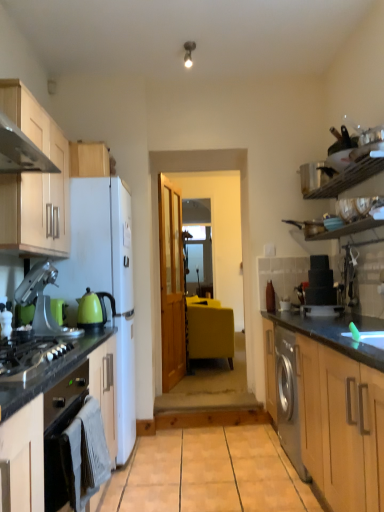
Question: Does black granite countertop at right have a lesser height compared to white glossy plate at right, which is counted as the second appliance, starting from the top?

Choices:
 (A) no
 (B) yes

Answer: (A)

Question: Is black granite countertop at right oriented towards white glossy plate at right, which is counted as the second appliance, starting from the top?

Choices:
 (A) yes
 (B) no

Answer: (B)

Question: Can you confirm if black granite countertop at right is thinner than white glossy plate at right, which is counted as the second appliance, starting from the top?

Choices:
 (A) yes
 (B) no

Answer: (B)

Question: From the image's perspective, does black granite countertop at right appear lower than white glossy plate at right, the first appliance in the bottom-to-top sequence?

Choices:
 (A) yes
 (B) no

Answer: (A)

Question: Considering the relative sizes of black granite countertop at right and white glossy plate at right, which is counted as the second appliance, starting from the top, in the image provided, is black granite countertop at right wider than white glossy plate at right, which is counted as the second appliance, starting from the top,?

Choices:
 (A) yes
 (B) no

Answer: (A)

Question: From a real-world perspective, is white matte refrigerator at left physically located above or below metallic silver pot at upper right, which ranks as the 2th appliance in bottom-to-top order?

Choices:
 (A) below
 (B) above

Answer: (A)

Question: In the image, is white matte refrigerator at left positioned in front of or behind metallic silver pot at upper right, which ranks as the 2th appliance in bottom-to-top order?

Choices:
 (A) behind
 (B) front

Answer: (B)

Question: Is white matte refrigerator at left inside the boundaries of metallic silver pot at upper right, which ranks as the 2th appliance in bottom-to-top order, or outside?

Choices:
 (A) inside
 (B) outside

Answer: (B)

Question: Looking at their shapes, would you say white matte refrigerator at left is wider or thinner than metallic silver pot at upper right, which ranks as the 2th appliance in bottom-to-top order?

Choices:
 (A) thin
 (B) wide

Answer: (B)

Question: Is metallic silver pot at upper right, which ranks as the 2th appliance in bottom-to-top order, situated inside black granite countertop at right or outside?

Choices:
 (A) inside
 (B) outside

Answer: (B)

Question: Would you say metallic silver pot at upper right, which ranks as the 2th appliance in bottom-to-top order, is to the left or to the right of black granite countertop at right in the picture?

Choices:
 (A) left
 (B) right

Answer: (B)

Question: Is point (301, 172) closer or farther from the camera than point (369, 370)?

Choices:
 (A) closer
 (B) farther

Answer: (B)

Question: In the image, is metallic silver pot at upper right, which ranks as the 2th appliance in bottom-to-top order, positioned in front of or behind black granite countertop at right?

Choices:
 (A) behind
 (B) front

Answer: (A)

Question: From the image's perspective, is white glossy plate at right, the first appliance in the bottom-to-top sequence, located above or below transparent glass door at center?

Choices:
 (A) below
 (B) above

Answer: (A)

Question: Considering the relative positions of white glossy plate at right, which is counted as the second appliance, starting from the top, and transparent glass door at center in the image provided, is white glossy plate at right, which is counted as the second appliance, starting from the top, to the left or to the right of transparent glass door at center?

Choices:
 (A) left
 (B) right

Answer: (B)